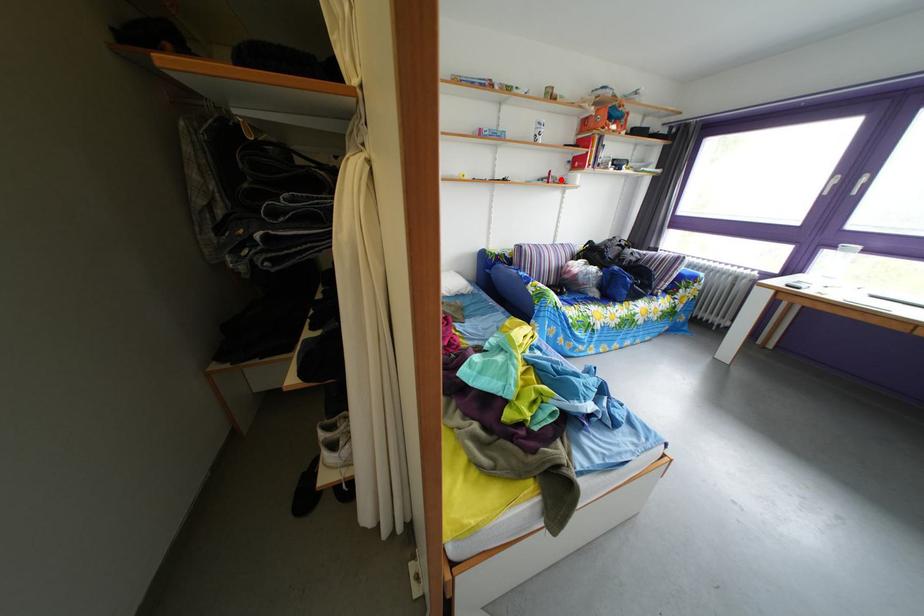
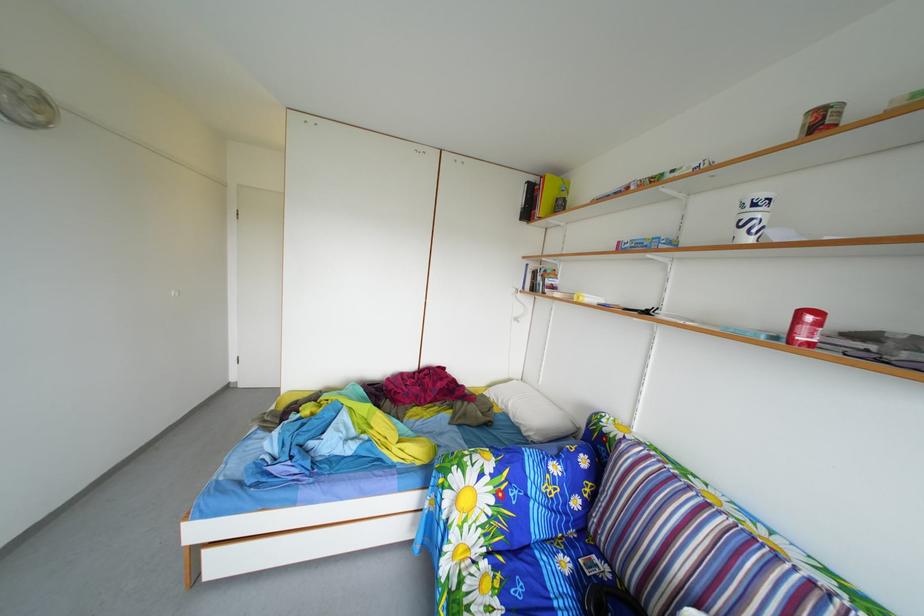
Question: A red point is marked in image1. In image2, is the corresponding 3D point closer to the camera or farther? Reply with the corresponding letter.

Choices:
 (A) The corresponding 3D point is closer.
 (B) The corresponding 3D point is farther.

Answer: (B)